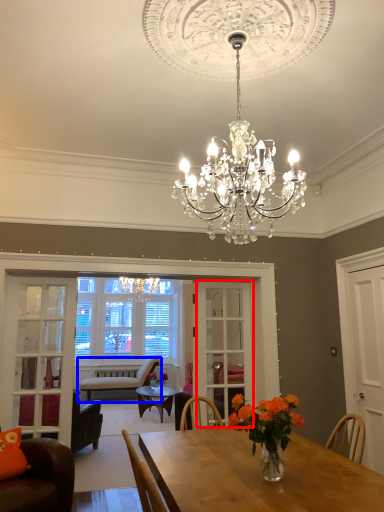
Question: Which point is further to the camera, glass door (highlighted by a red box) or chair (highlighted by a blue box)?

Choices:
 (A) glass door
 (B) chair

Answer: (B)